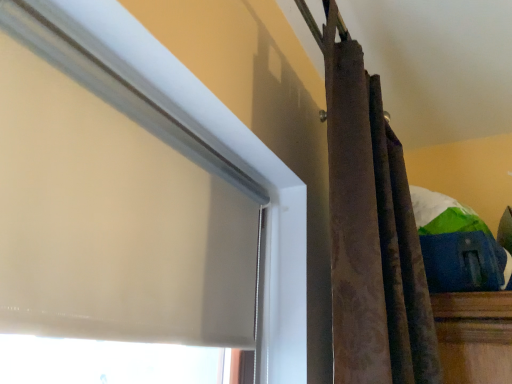
What do you see at coordinates (184, 142) in the screenshot? I see `beige fabric window at upper left` at bounding box center [184, 142].

Find the location of `beige fabric window at upper left`. beige fabric window at upper left is located at coordinates (184, 142).

The height and width of the screenshot is (384, 512). Find the location of `beige fabric window at upper left`. beige fabric window at upper left is located at coordinates (184, 142).